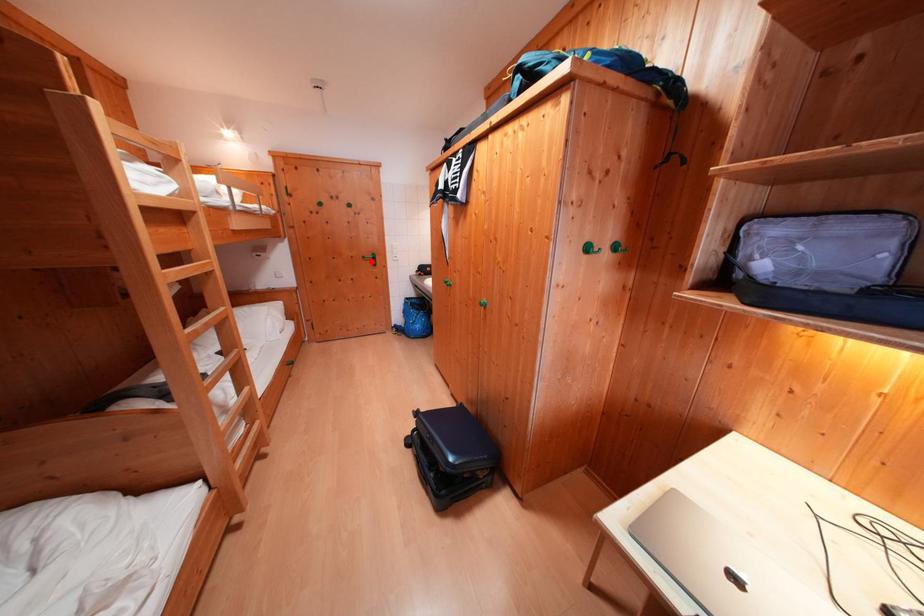
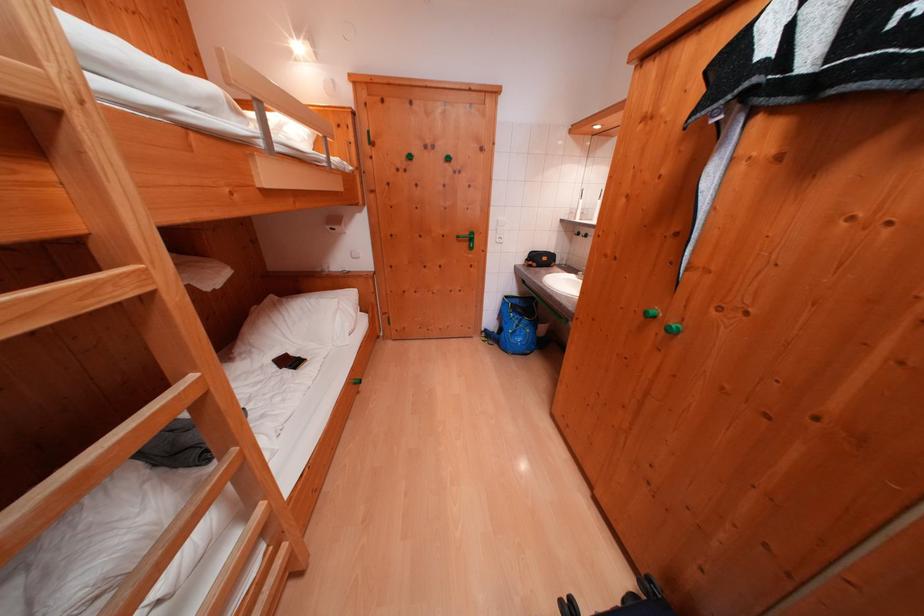
Locate, in the second image, the point that corresponds to the highlighted location in the first image.

(466, 241)